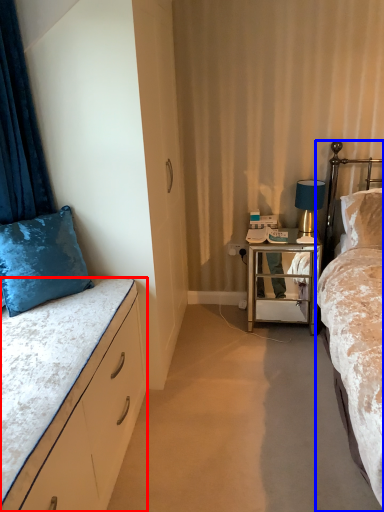
Question: Which object appears farthest to the camera in this image, bed (highlighted by a red box) or bed (highlighted by a blue box)?

Choices:
 (A) bed
 (B) bed

Answer: (A)